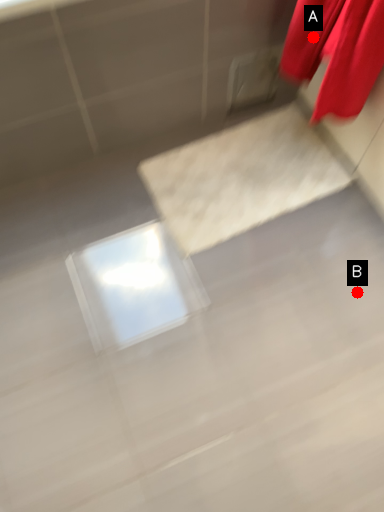
Question: Two points are circled on the image, labeled by A and B beside each circle. Which point appears closest to the camera in this image?

Choices:
 (A) A is closer
 (B) B is closer

Answer: (A)